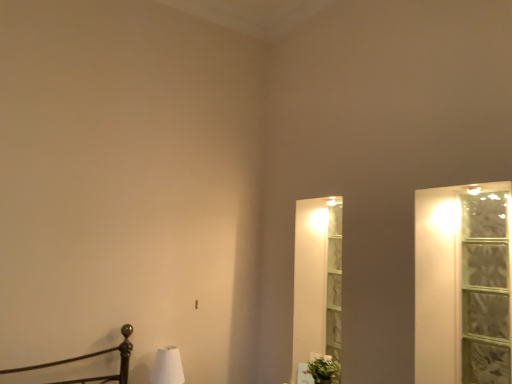
Question: Considering the relative positions of white matte table lamp at lower left and green leafy plant at lower right in the image provided, is white matte table lamp at lower left to the right of green leafy plant at lower right from the viewer's perspective?

Choices:
 (A) yes
 (B) no

Answer: (B)

Question: Is white matte table lamp at lower left thinner than green leafy plant at lower right?

Choices:
 (A) no
 (B) yes

Answer: (A)

Question: Is white matte table lamp at lower left shorter than green leafy plant at lower right?

Choices:
 (A) no
 (B) yes

Answer: (A)

Question: Is white matte table lamp at lower left in front of green leafy plant at lower right?

Choices:
 (A) no
 (B) yes

Answer: (B)

Question: Does white matte table lamp at lower left come behind green leafy plant at lower right?

Choices:
 (A) yes
 (B) no

Answer: (B)

Question: From a real-world perspective, is white matte table lamp at lower left beneath green leafy plant at lower right?

Choices:
 (A) yes
 (B) no

Answer: (B)

Question: Is green leafy plant at lower right next to white matte table lamp at lower left and touching it?

Choices:
 (A) yes
 (B) no

Answer: (B)

Question: From the image's perspective, is green leafy plant at lower right under white matte table lamp at lower left?

Choices:
 (A) yes
 (B) no

Answer: (A)

Question: Does green leafy plant at lower right come in front of white matte table lamp at lower left?

Choices:
 (A) no
 (B) yes

Answer: (A)

Question: Is green leafy plant at lower right outside white matte table lamp at lower left?

Choices:
 (A) yes
 (B) no

Answer: (A)

Question: Does green leafy plant at lower right turn towards white matte table lamp at lower left?

Choices:
 (A) yes
 (B) no

Answer: (B)

Question: From a real-world perspective, is green leafy plant at lower right positioned under white matte table lamp at lower left based on gravity?

Choices:
 (A) no
 (B) yes

Answer: (B)

Question: Does clear glass window at right appear on the left side of white matte table lamp at lower left?

Choices:
 (A) yes
 (B) no

Answer: (B)